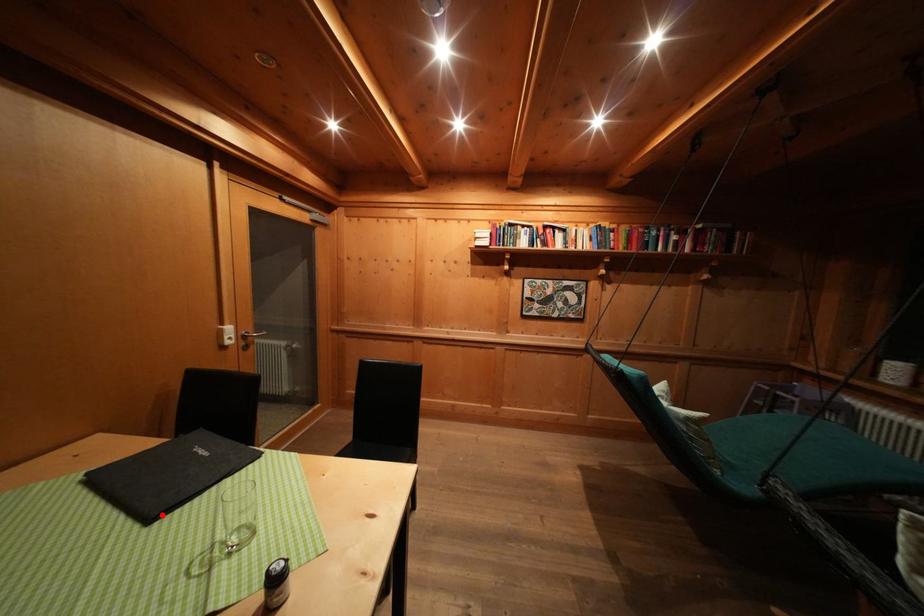
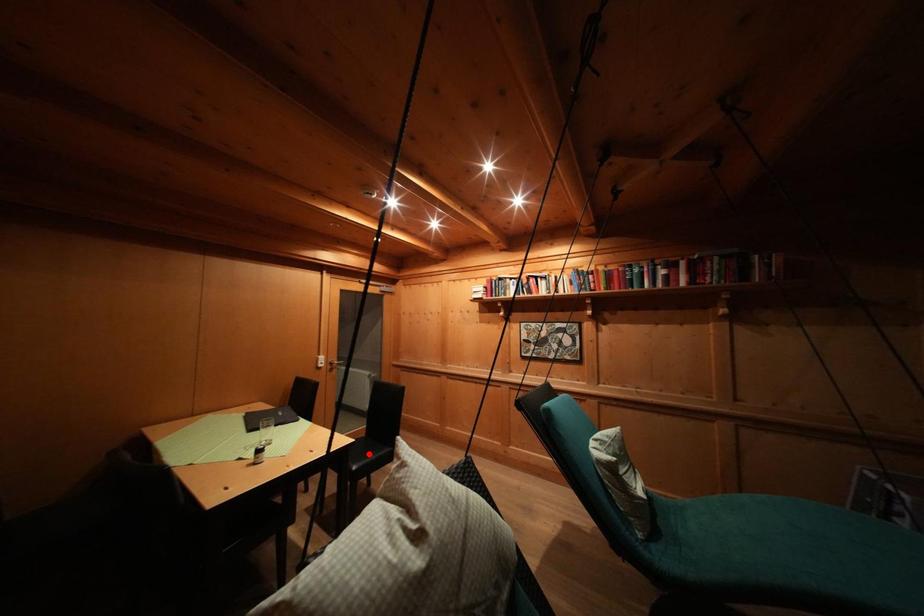
I am providing you with two images of the same scene from different viewpoints. A red point is marked on the first image and another point is marked on the second image. Does the point marked in image1 correspond to the same location as the one in image2?

No